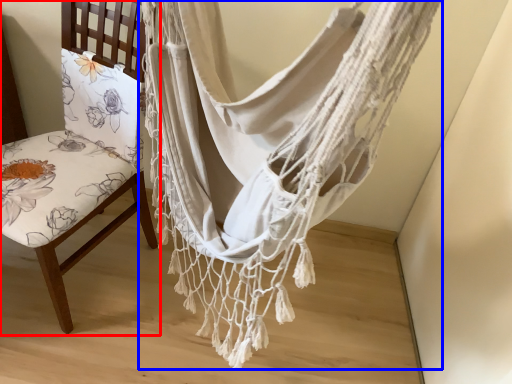
Question: Which point is further to the camera, chair (highlighted by a red box) or curtain (highlighted by a blue box)?

Choices:
 (A) chair
 (B) curtain

Answer: (A)